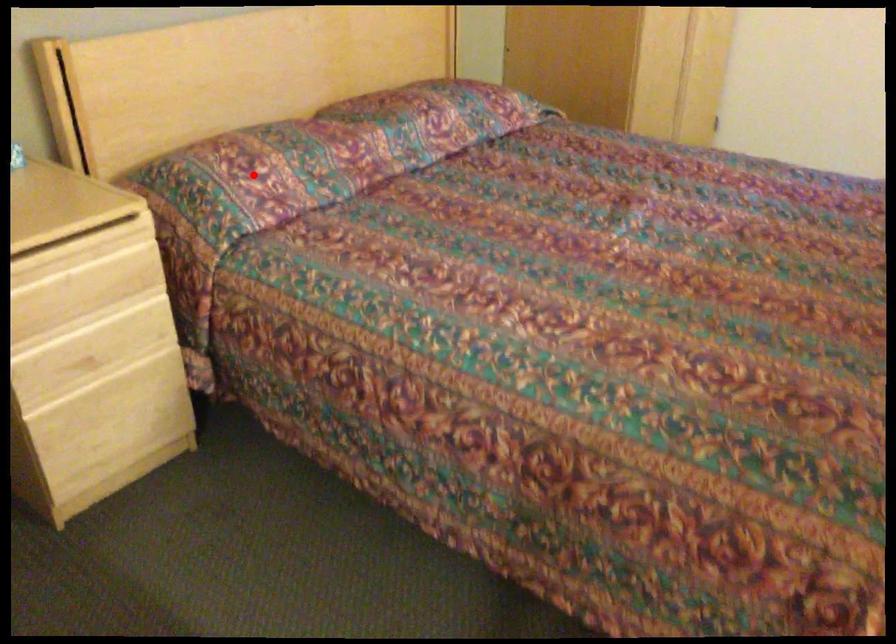
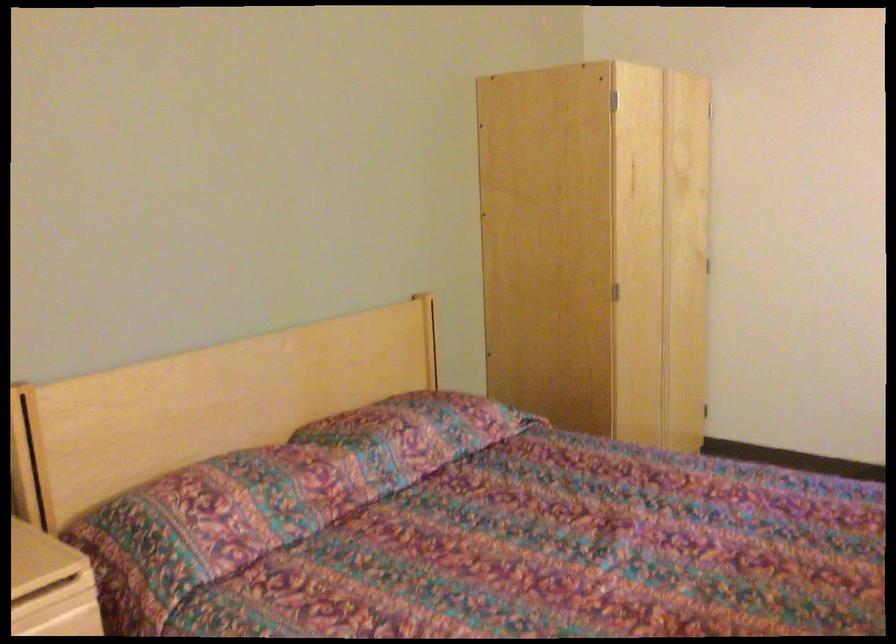
In the second image, find the point that corresponds to the highlighted location in the first image.

(211, 518)